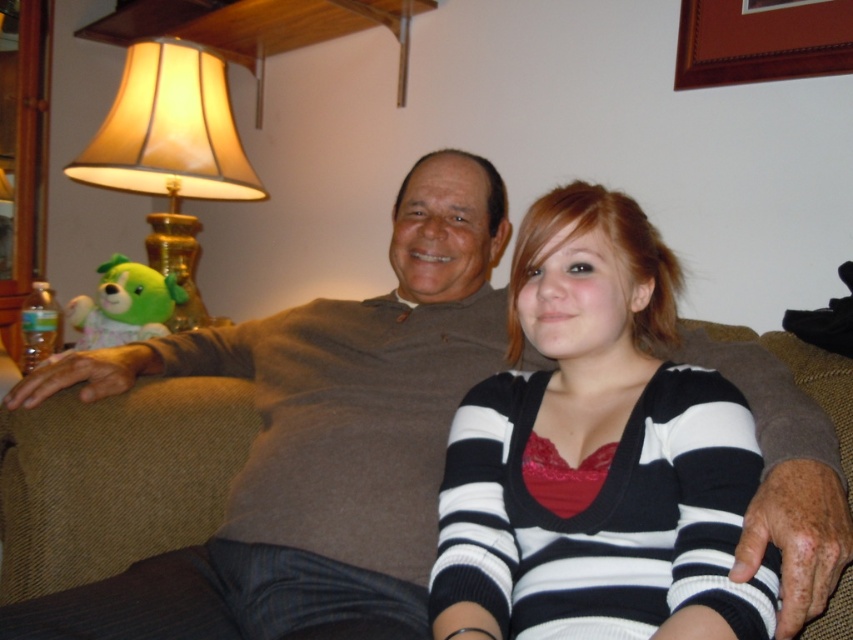
Question: Can you confirm if beige fabric lampshade at upper left is positioned above green plush bear at left?

Choices:
 (A) no
 (B) yes

Answer: (B)

Question: Estimate the real-world distances between objects in this image. Which object is farther from the green plush bear at left?

Choices:
 (A) brown wooden picture frame at upper right
 (B) striped knit sweater at center
 (C) beige fabric lampshade at upper left
 (D) brown fabric couch at center

Answer: (A)

Question: Which object is positioned closest to the beige fabric lampshade at upper left?

Choices:
 (A) brown fabric couch at center
 (B) brown wooden picture frame at upper right

Answer: (A)

Question: Is brown fabric couch at center wider than green plush bear at left?

Choices:
 (A) no
 (B) yes

Answer: (B)

Question: Is brown fabric couch at center to the right of brown wooden picture frame at upper right from the viewer's perspective?

Choices:
 (A) no
 (B) yes

Answer: (A)

Question: Which point appears farthest from the camera in this image?

Choices:
 (A) (62, 598)
 (B) (561, 540)
 (C) (192, 49)
 (D) (126, 291)

Answer: (C)